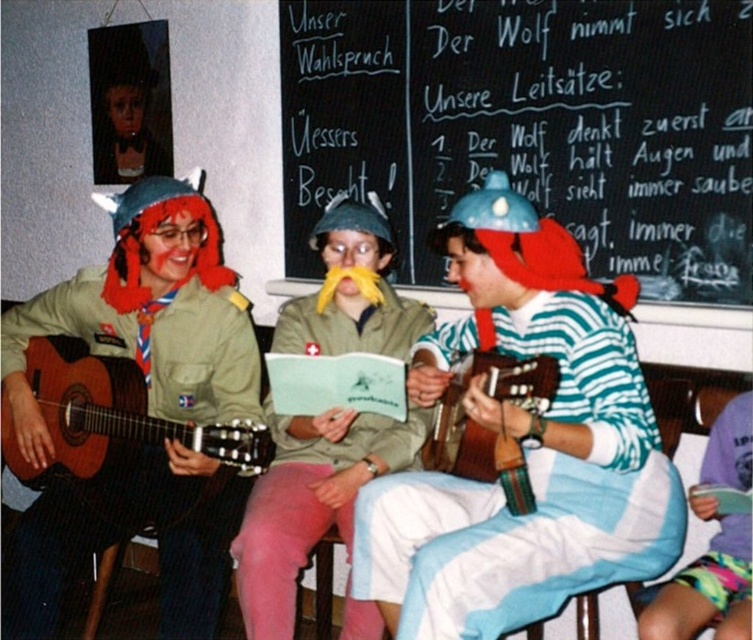
Describe the element at coordinates (523, 445) in the screenshot. I see `striped cotton shirt at center` at that location.

Does point (663, 483) come closer to viewer compared to point (105, 403)?

Yes, it is.

Image resolution: width=753 pixels, height=640 pixels. I want to click on striped cotton shirt at center, so click(523, 445).

Consider the image. Can you confirm if striped cotton shirt at center is wider than yellow felt mustache at center?

Indeed, striped cotton shirt at center has a greater width compared to yellow felt mustache at center.

Is point (355, 508) less distant than point (386, 324)?

Yes, it is.

Is point (547, 509) more distant than point (312, 308)?

No, it is not.

Find the location of a particular element. This screenshot has width=753, height=640. striped cotton shirt at center is located at coordinates (523, 445).

Does yellow felt mustache at center have a larger size compared to wooden acoustic guitar at left?

Indeed, yellow felt mustache at center has a larger size compared to wooden acoustic guitar at left.

Which is in front, point (364, 465) or point (119, 451)?

Point (364, 465)

The image size is (753, 640). I want to click on yellow felt mustache at center, so click(309, 502).